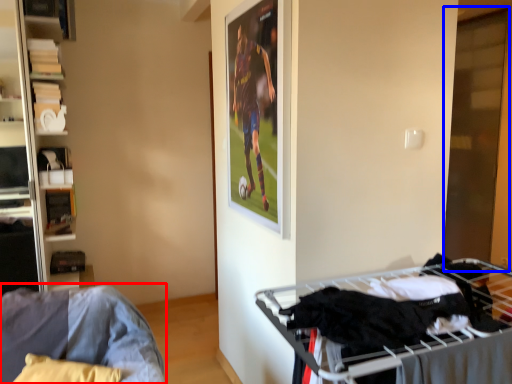
Question: Which of the following is the farthest to the observer, furniture (highlighted by a red box) or glass door (highlighted by a blue box)?

Choices:
 (A) furniture
 (B) glass door

Answer: (B)